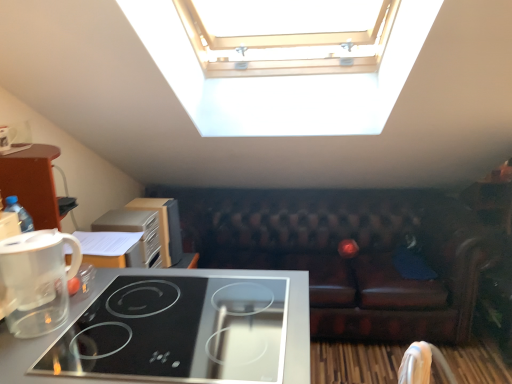
This screenshot has width=512, height=384. Find the location of `vacant space situated above black glass cooktop at lower left (from a real-world perspective)`. vacant space situated above black glass cooktop at lower left (from a real-world perspective) is located at coordinates (130, 328).